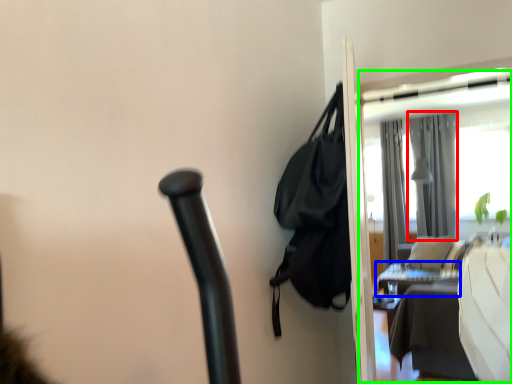
Question: Which object is the closest to the curtain (highlighted by a red box)? Choose among these: table (highlighted by a blue box) or screen door (highlighted by a green box).

Choices:
 (A) table
 (B) screen door

Answer: (B)